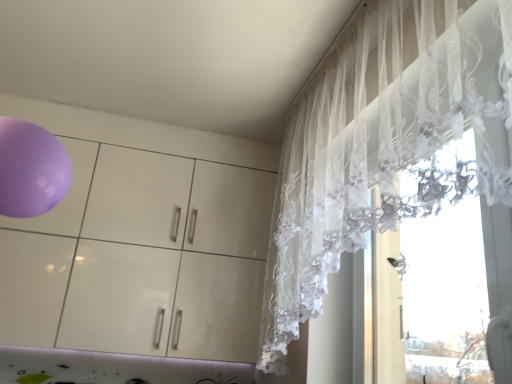
I want to click on white lace curtain at right, so click(x=383, y=143).

What do you see at coordinates (383, 143) in the screenshot? I see `white lace curtain at right` at bounding box center [383, 143].

Identify the location of glossy white dresser at upper left. click(141, 240).

What do you see at coordinates (141, 240) in the screenshot?
I see `glossy white dresser at upper left` at bounding box center [141, 240].

What is the approximate height of glossy white dresser at upper left?

3.86 feet.

Locate an element on the screen. The width and height of the screenshot is (512, 384). white lace curtain at right is located at coordinates (383, 143).

In the image, is white lace curtain at right on the left side or the right side of glossy white dresser at upper left?

Clearly, white lace curtain at right is on the right of glossy white dresser at upper left in the image.

Which object is further away from the camera, white lace curtain at right or glossy white dresser at upper left?

glossy white dresser at upper left is behind.

Which is more distant, (x=401, y=68) or (x=124, y=202)?

Point (x=124, y=202)

From the image's perspective, which object appears higher, white lace curtain at right or glossy white dresser at upper left?

From the image's view, white lace curtain at right is above.

From a real-world perspective, is white lace curtain at right over glossy white dresser at upper left?

Yes, from a real-world perspective, white lace curtain at right is on top of glossy white dresser at upper left.

Looking at their sizes, would you say white lace curtain at right is wider or thinner than glossy white dresser at upper left?

In the image, white lace curtain at right appears to be more narrow than glossy white dresser at upper left.

Does white lace curtain at right have a greater height compared to glossy white dresser at upper left?

Answer: Yes, white lace curtain at right is taller than glossy white dresser at upper left.

Who is bigger, white lace curtain at right or glossy white dresser at upper left?

With larger size is glossy white dresser at upper left.

Could glossy white dresser at upper left be considered to be inside white lace curtain at right?

Actually, glossy white dresser at upper left is outside white lace curtain at right.

Is the surface of white lace curtain at right in direct contact with glossy white dresser at upper left?

No, white lace curtain at right is not next to glossy white dresser at upper left.

Does white lace curtain at right turn towards glossy white dresser at upper left?

No, white lace curtain at right is not oriented towards glossy white dresser at upper left.

Can you tell me how much white lace curtain at right and glossy white dresser at upper left differ in facing direction?

The angular difference between white lace curtain at right and glossy white dresser at upper left is 90 degrees.

Identify the location of dresser beneath the white lace curtain at right (from a real-world perspective). (141, 240).

Is glossy white dresser at upper left to the right of white lace curtain at right from the viewer's perspective?

No, glossy white dresser at upper left is not to the right of white lace curtain at right.

Between glossy white dresser at upper left and white lace curtain at right, which one is positioned behind?

glossy white dresser at upper left is further away from the camera.

Does point (219, 280) lie in front of point (448, 140)?

No, (219, 280) is further to viewer.

From the image's perspective, which is above, glossy white dresser at upper left or white lace curtain at right?

white lace curtain at right is shown above in the image.

From a real-world perspective, between glossy white dresser at upper left and white lace curtain at right, who is vertically higher?

white lace curtain at right.

Between glossy white dresser at upper left and white lace curtain at right, which one has smaller width?

With smaller width is white lace curtain at right.

Can you confirm if glossy white dresser at upper left is shorter than white lace curtain at right?

Yes, glossy white dresser at upper left is shorter than white lace curtain at right.

Looking at this image, is glossy white dresser at upper left smaller than white lace curtain at right?

Actually, glossy white dresser at upper left might be larger than white lace curtain at right.

Does glossy white dresser at upper left contain white lace curtain at right?

Actually, white lace curtain at right is outside glossy white dresser at upper left.

Are glossy white dresser at upper left and white lace curtain at right beside each other?

No, glossy white dresser at upper left is not touching white lace curtain at right.

Is glossy white dresser at upper left facing away from white lace curtain at right?

No, glossy white dresser at upper left is not facing away from white lace curtain at right.

How much distance is there between glossy white dresser at upper left and white lace curtain at right?

glossy white dresser at upper left is 32.86 inches away from white lace curtain at right.

Find the location of `curtain on the right of the glossy white dresser at upper left`. curtain on the right of the glossy white dresser at upper left is located at coordinates (383, 143).

Identify the location of curtain located above the glossy white dresser at upper left (from a real-world perspective). This screenshot has width=512, height=384. (383, 143).

Image resolution: width=512 pixels, height=384 pixels. In order to click on curtain in front of the glossy white dresser at upper left in this screenshot , I will do `click(383, 143)`.